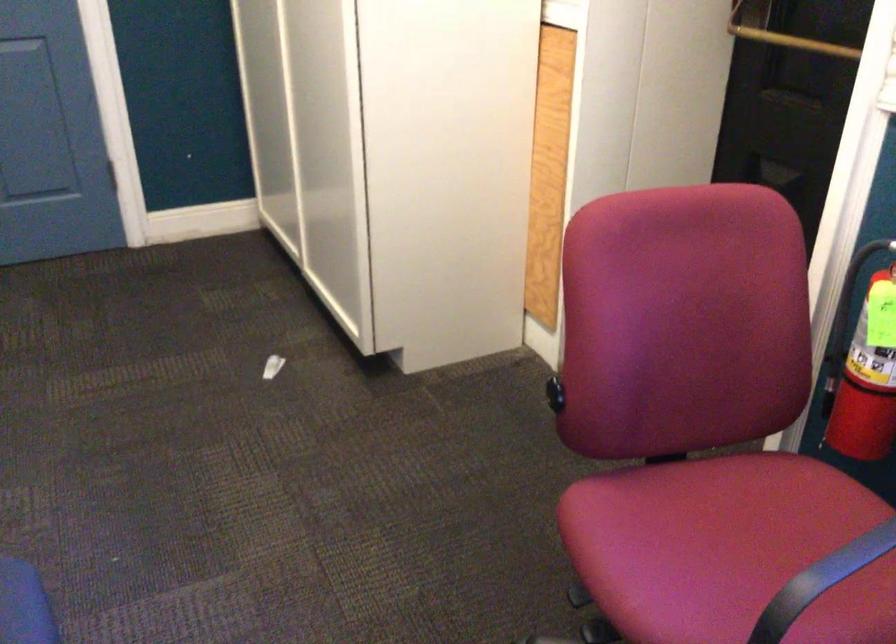
The image size is (896, 644). What do you see at coordinates (555, 393) in the screenshot?
I see `the black chair knob` at bounding box center [555, 393].